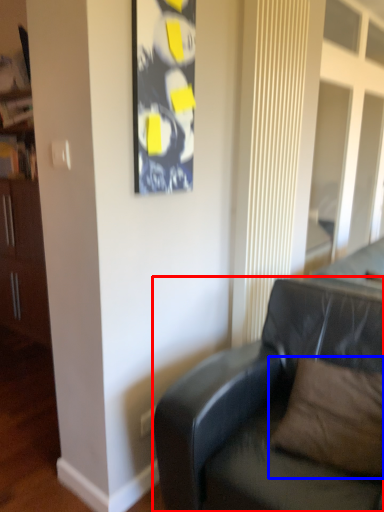
Question: Among these objects, which one is nearest to the camera, studio couch (highlighted by a red box) or pillow (highlighted by a blue box)?

Choices:
 (A) studio couch
 (B) pillow

Answer: (A)